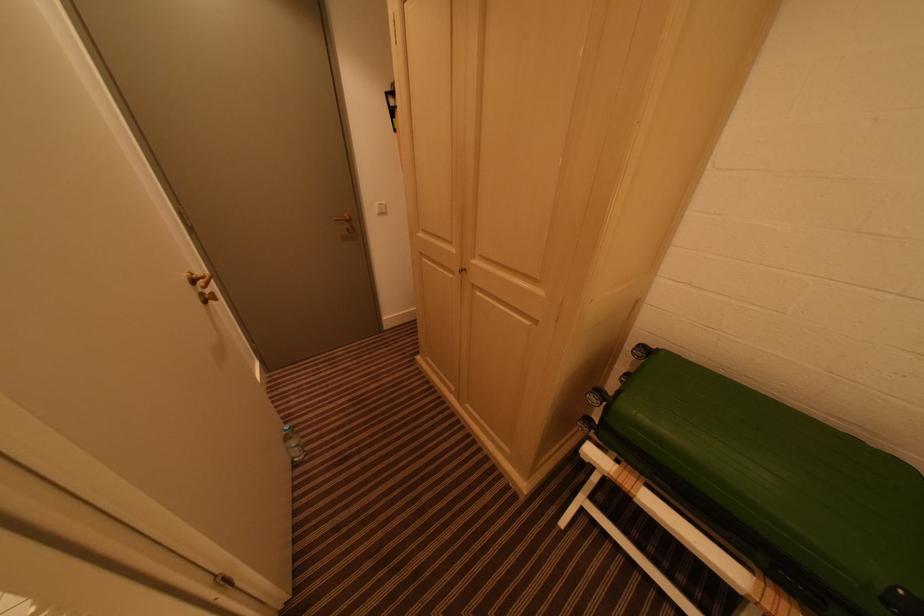
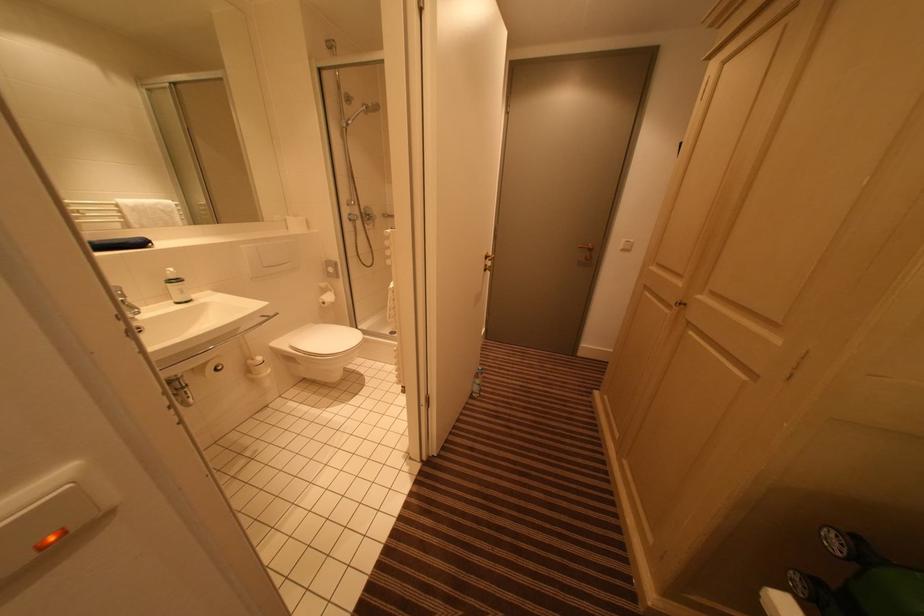
Question: The images are taken continuously from a first-person perspective. In which direction is your viewpoint rotating?

Choices:
 (A) Left
 (B) Right
 (C) Up
 (D) Down

Answer: (A)